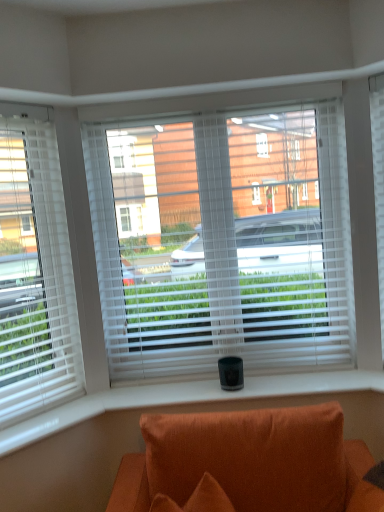
Question: Is white blinds at center, the 1th window viewed from the right, oriented towards white blinds at left, the second window viewed from the right?

Choices:
 (A) yes
 (B) no

Answer: (B)

Question: Does white blinds at center, the 1th window viewed from the right, have a larger size compared to white blinds at left, the second window viewed from the right?

Choices:
 (A) no
 (B) yes

Answer: (B)

Question: Can you confirm if white blinds at center, the 1th window viewed from the right, is wider than white blinds at left, the second window viewed from the right?

Choices:
 (A) no
 (B) yes

Answer: (A)

Question: Is white blinds at center, which is counted as the second window, starting from the left, touching white blinds at left, which ranks as the first window in left-to-right order?

Choices:
 (A) yes
 (B) no

Answer: (B)

Question: Is white blinds at center, which is counted as the second window, starting from the left, completely or partially outside of white blinds at left, which ranks as the first window in left-to-right order?

Choices:
 (A) no
 (B) yes

Answer: (B)

Question: From the image's perspective, is white blinds at left, which ranks as the first window in left-to-right order, above or below white textured blind at right?

Choices:
 (A) below
 (B) above

Answer: (A)

Question: In terms of size, does white blinds at left, the second window viewed from the right, appear bigger or smaller than white textured blind at right?

Choices:
 (A) small
 (B) big

Answer: (B)

Question: Considering their positions, is white blinds at left, which ranks as the first window in left-to-right order, located in front of or behind white textured blind at right?

Choices:
 (A) front
 (B) behind

Answer: (A)

Question: From their relative heights in the image, would you say white blinds at left, which ranks as the first window in left-to-right order, is taller or shorter than white textured blind at right?

Choices:
 (A) short
 (B) tall

Answer: (B)

Question: In terms of height, does white textured blind at right look taller or shorter compared to white blinds at left, the second window viewed from the right?

Choices:
 (A) tall
 (B) short

Answer: (B)

Question: Based on their positions, is white textured blind at right located to the left or right of white blinds at left, which ranks as the first window in left-to-right order?

Choices:
 (A) right
 (B) left

Answer: (A)

Question: From the image's perspective, is white textured blind at right above or below white blinds at left, the second window viewed from the right?

Choices:
 (A) above
 (B) below

Answer: (A)

Question: Does point (380, 161) appear closer or farther from the camera than point (23, 215)?

Choices:
 (A) farther
 (B) closer

Answer: (A)

Question: Looking at their shapes, would you say orange fabric couch at lower center is wider or thinner than white blinds at center, which is counted as the second window, starting from the left?

Choices:
 (A) wide
 (B) thin

Answer: (A)

Question: In terms of size, does orange fabric couch at lower center appear bigger or smaller than white blinds at center, which is counted as the second window, starting from the left?

Choices:
 (A) big
 (B) small

Answer: (A)